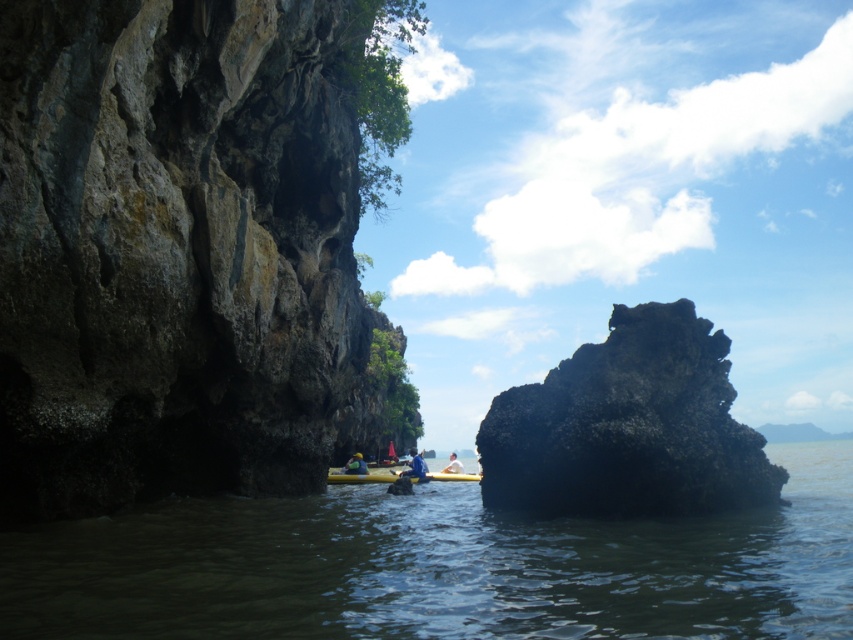
Question: Estimate the real-world distances between objects in this image. Which object is farther from the black rough rock at center?

Choices:
 (A) matte yellow kayak at center
 (B) rough stone cliff at left
 (C) yellow plastic kayak at center
 (D) blue rubber boat at center

Answer: (C)

Question: Does blue rubber boat at center have a lesser width compared to blue fabric person at center?

Choices:
 (A) no
 (B) yes

Answer: (A)

Question: Is blue fabric person at center bigger than matte yellow kayak at center?

Choices:
 (A) no
 (B) yes

Answer: (B)

Question: Which object is positioned closest to the black rough rock at center?

Choices:
 (A) matte yellow kayak at center
 (B) rough stone cliff at left
 (C) blue rubber boat at center
 (D) yellow plastic kayak at center

Answer: (B)

Question: In this image, where is black rough rock at center located relative to blue fabric person at center?

Choices:
 (A) right
 (B) left

Answer: (A)

Question: Which object is positioned farthest from the black rough rock at center?

Choices:
 (A) rough stone cliff at left
 (B) blue rubber boat at center
 (C) blue fabric person at center

Answer: (C)